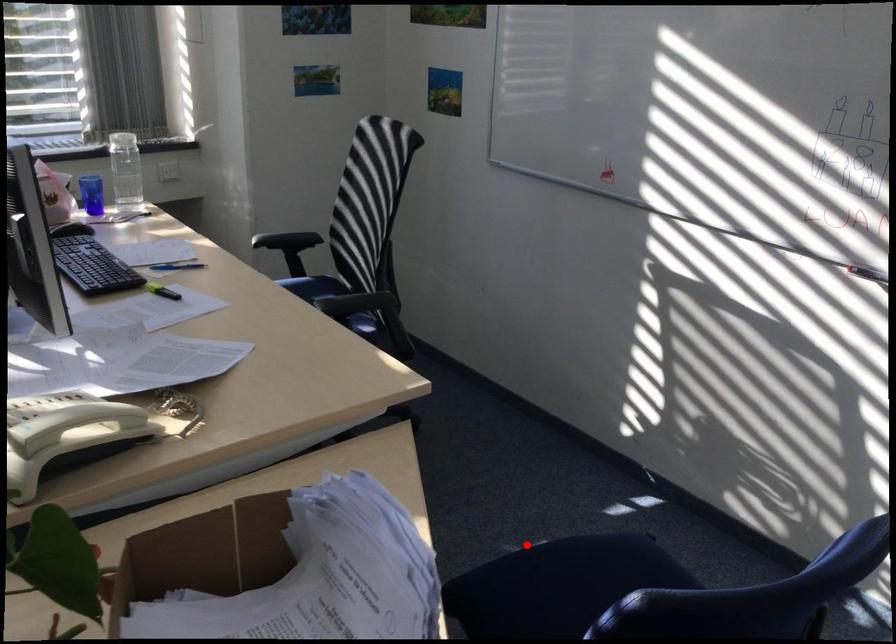
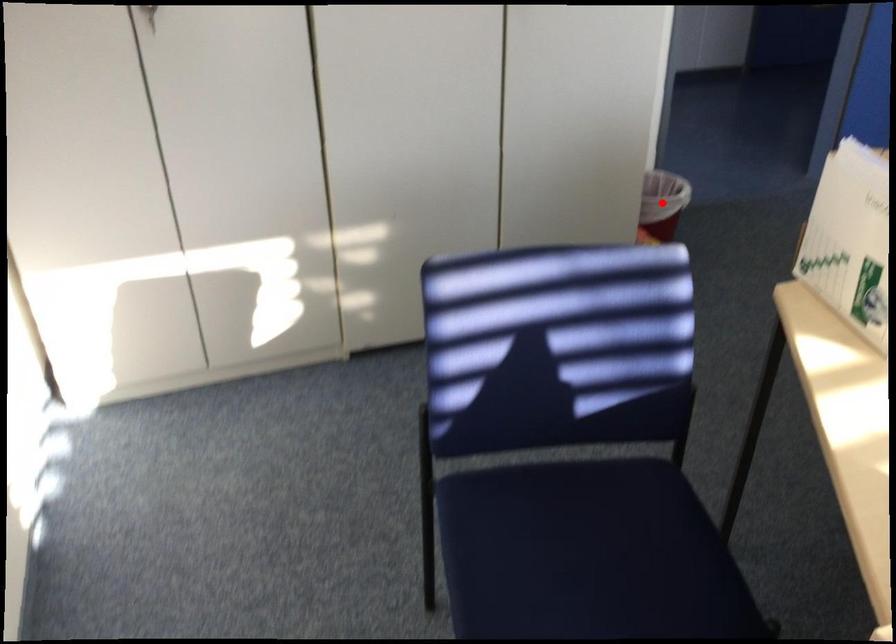
In the scene shown: I am providing you with two images of the same scene from different viewpoints. A red point is marked on the first image and another point is marked on the second image. Is the marked point in image1 the same physical position as the marked point in image2?

No